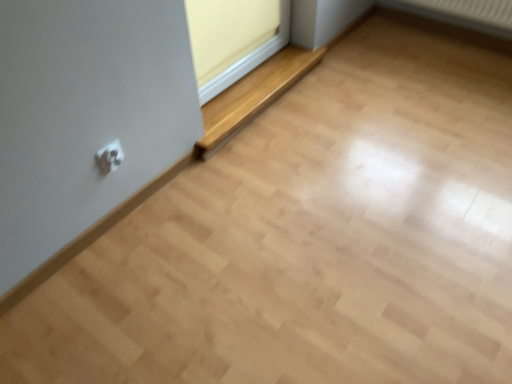
This screenshot has width=512, height=384. Identify the location of white plastic electric outlet at lower left. (110, 157).

Find the location of a particular element. matte yellow window frame at upper center is located at coordinates (233, 39).

Between wooden at lower center and white plastic electric outlet at lower left, which one is positioned behind?

wooden at lower center is behind.

Does wooden at lower center have a larger size compared to white plastic electric outlet at lower left?

Indeed, wooden at lower center has a larger size compared to white plastic electric outlet at lower left.

Looking at this image, is wooden at lower center oriented away from white plastic electric outlet at lower left?

No, wooden at lower center is not facing the opposite direction of white plastic electric outlet at lower left.

The width and height of the screenshot is (512, 384). Find the location of `balustrade above the white plastic electric outlet at lower left (from the image's perspective)`. balustrade above the white plastic electric outlet at lower left (from the image's perspective) is located at coordinates (253, 95).

Who is shorter, white plastic electric outlet at lower left or wooden at lower center?

With less height is white plastic electric outlet at lower left.

Is white plastic electric outlet at lower left bigger than wooden at lower center?

No.

Between point (102, 170) and point (253, 76), which one is positioned in front?

The point (102, 170) is more forward.

Is white plastic electric outlet at lower left aimed at wooden at lower center?

No, white plastic electric outlet at lower left is not oriented towards wooden at lower center.

From the image's perspective, is matte yellow window frame at upper center above wooden at lower center?

Yes, from the image's perspective, matte yellow window frame at upper center is above wooden at lower center.

Looking at this image, considering the sizes of matte yellow window frame at upper center and wooden at lower center in the image, is matte yellow window frame at upper center bigger or smaller than wooden at lower center?

Clearly, matte yellow window frame at upper center is smaller in size than wooden at lower center.

Is matte yellow window frame at upper center not within wooden at lower center?

Yes, matte yellow window frame at upper center is not within wooden at lower center.

Is matte yellow window frame at upper center thinner than wooden at lower center?

Yes, matte yellow window frame at upper center is thinner than wooden at lower center.

Does matte yellow window frame at upper center have a lesser height compared to white plastic electric outlet at lower left?

No.

Considering the positions of point (229, 51) and point (101, 156), is point (229, 51) closer or farther from the camera than point (101, 156)?

Clearly, point (229, 51) is more distant from the camera than point (101, 156).

In the image, is matte yellow window frame at upper center on the left side or the right side of white plastic electric outlet at lower left?

matte yellow window frame at upper center is positioned on white plastic electric outlet at lower left's right side.

Based on the photo, is matte yellow window frame at upper center oriented towards white plastic electric outlet at lower left?

No, matte yellow window frame at upper center is not turned towards white plastic electric outlet at lower left.

Is point (256, 83) positioned behind point (260, 28)?

Yes, point (256, 83) is behind point (260, 28).

I want to click on window frame that is above the wooden at lower center (from the image's perspective), so click(233, 39).

Looking at this image, from a real-world perspective, is wooden at lower center over matte yellow window frame at upper center?

No, from a real-world perspective, wooden at lower center is not above matte yellow window frame at upper center.

In the image, is wooden at lower center positioned in front of or behind matte yellow window frame at upper center?

In the image, wooden at lower center appears behind matte yellow window frame at upper center.

From the picture: From a real-world perspective, is white plastic electric outlet at lower left located higher than matte yellow window frame at upper center?

Actually, white plastic electric outlet at lower left is physically below matte yellow window frame at upper center in the real world.

Is white plastic electric outlet at lower left taller or shorter than matte yellow window frame at upper center?

white plastic electric outlet at lower left is shorter than matte yellow window frame at upper center.

Is white plastic electric outlet at lower left thinner than matte yellow window frame at upper center?

Indeed, white plastic electric outlet at lower left has a lesser width compared to matte yellow window frame at upper center.

How different are the orientations of white plastic electric outlet at lower left and matte yellow window frame at upper center in degrees?

0.484 degrees.

The height and width of the screenshot is (384, 512). I want to click on balustrade above the white plastic electric outlet at lower left (from the image's perspective), so click(x=253, y=95).

Find the location of a particular element. The image size is (512, 384). balustrade on the right of white plastic electric outlet at lower left is located at coordinates (253, 95).

Estimate the real-world distances between objects in this image. Which object is closer to white plastic electric outlet at lower left, wooden at lower center or matte yellow window frame at upper center?

Based on the image, wooden at lower center appears to be nearer to white plastic electric outlet at lower left.

Looking at the image, which one is located further to matte yellow window frame at upper center, wooden at lower center or white plastic electric outlet at lower left?

white plastic electric outlet at lower left is positioned further to the anchor matte yellow window frame at upper center.

Estimate the real-world distances between objects in this image. Which object is closer to matte yellow window frame at upper center, white plastic electric outlet at lower left or wooden at lower center?

Among the two, wooden at lower center is located nearer to matte yellow window frame at upper center.

Which object lies further to the anchor point wooden at lower center, matte yellow window frame at upper center or white plastic electric outlet at lower left?

Among the two, white plastic electric outlet at lower left is located further to wooden at lower center.

When comparing their distances from white plastic electric outlet at lower left, does matte yellow window frame at upper center or wooden at lower center seem closer?

wooden at lower center lies closer to white plastic electric outlet at lower left than the other object.

Based on their spatial positions, is white plastic electric outlet at lower left or matte yellow window frame at upper center further from wooden at lower center?

white plastic electric outlet at lower left is positioned further to the anchor wooden at lower center.

Locate an element on the screen. The width and height of the screenshot is (512, 384). balustrade between matte yellow window frame at upper center and white plastic electric outlet at lower left in the up-down direction is located at coordinates (253, 95).